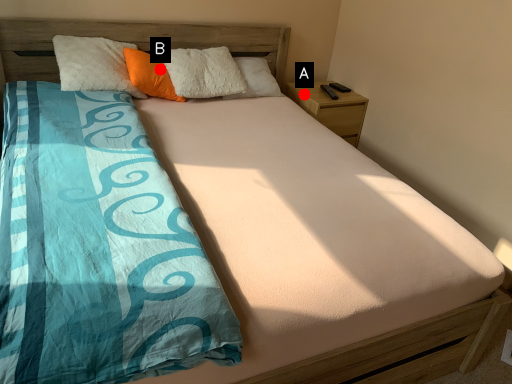
Question: Two points are circled on the image, labeled by A and B beside each circle. Which point is farther to the camera?

Choices:
 (A) A is further
 (B) B is further

Answer: (A)